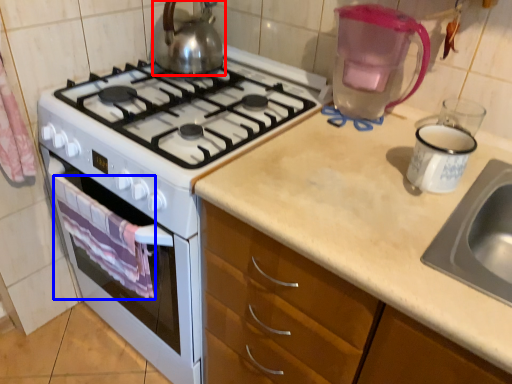
Question: Which object appears closest to the camera in this image, kettle (highlighted by a red box) or cloth (highlighted by a blue box)?

Choices:
 (A) kettle
 (B) cloth

Answer: (B)